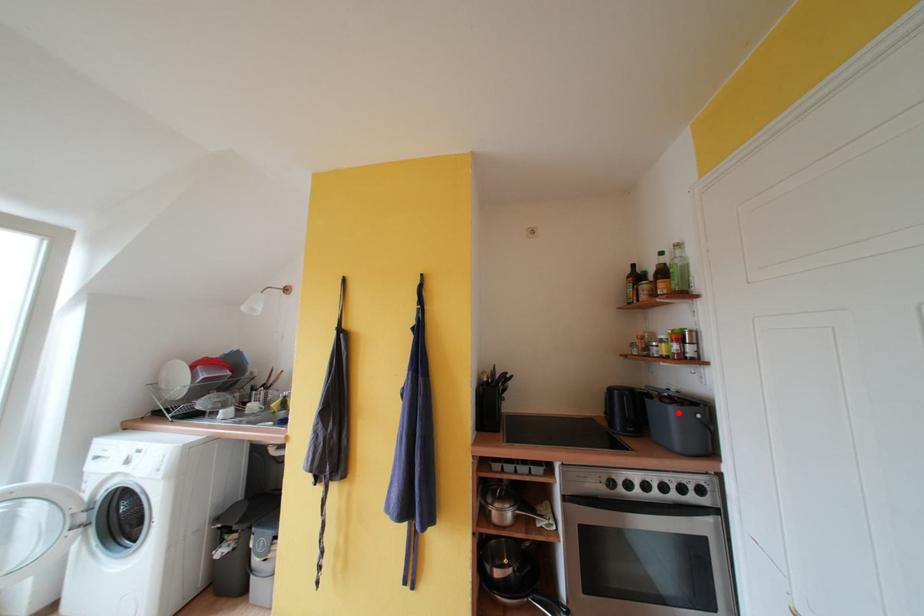
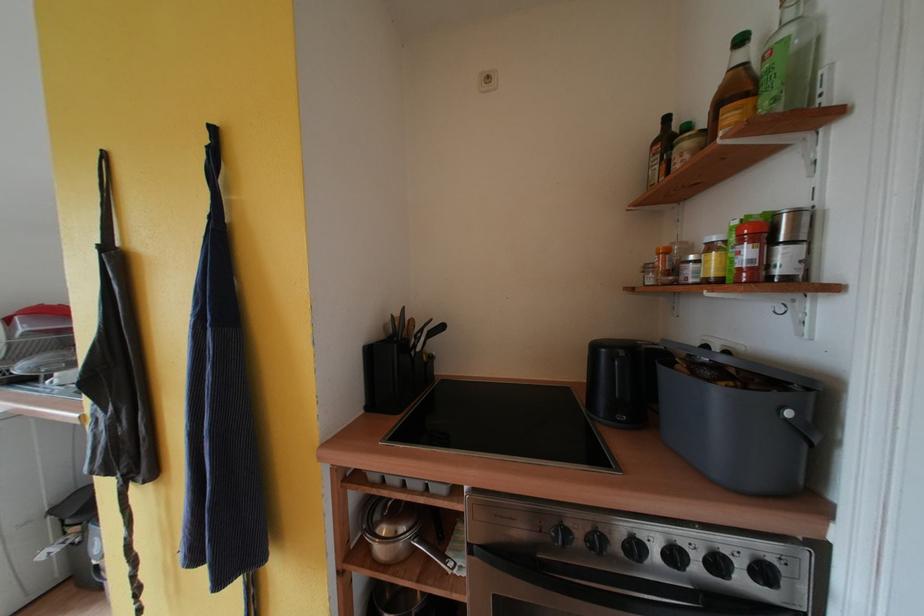
Where in the second image is the point corresponding to the highlighted location from the first image?

(723, 397)